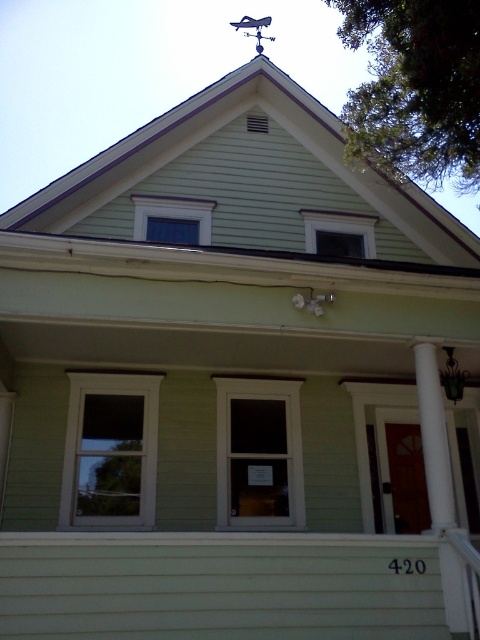
Locate an element on the screen. Image resolution: width=480 pixels, height=640 pixels. white wood window at center is located at coordinates (110, 451).

Does white wood window at center appear over metallic weather vane at upper center?

No.

Between point (124, 381) and point (244, 33), which one is positioned behind?

Point (244, 33)

The width and height of the screenshot is (480, 640). Identify the location of white wood window at center. (110, 451).

Is clear glass window at center in front of blue glass window at upper center?

Yes, clear glass window at center is closer to the viewer.

Is point (252, 506) less distant than point (200, 218)?

That is True.

You are a GUI agent. You are given a task and a screenshot of the screen. Output one action in this format:
    pyautogui.click(x=<x>, y=<y>)
    Task: Click on the clear glass window at center
    This screenshot has height=640, width=480.
    Given the screenshot: What is the action you would take?
    pyautogui.click(x=259, y=452)

Is point (239, 96) closer to viewer compared to point (263, 49)?

Yes, it is in front of point (263, 49).

Can you confirm if green siding at center is positioned above metallic weather vane at upper center?

Actually, green siding at center is below metallic weather vane at upper center.

Does point (120, 202) lie in front of point (254, 36)?

Yes, it is in front of point (254, 36).

Where is `green siding at center`? The image size is (480, 640). green siding at center is located at coordinates (232, 420).